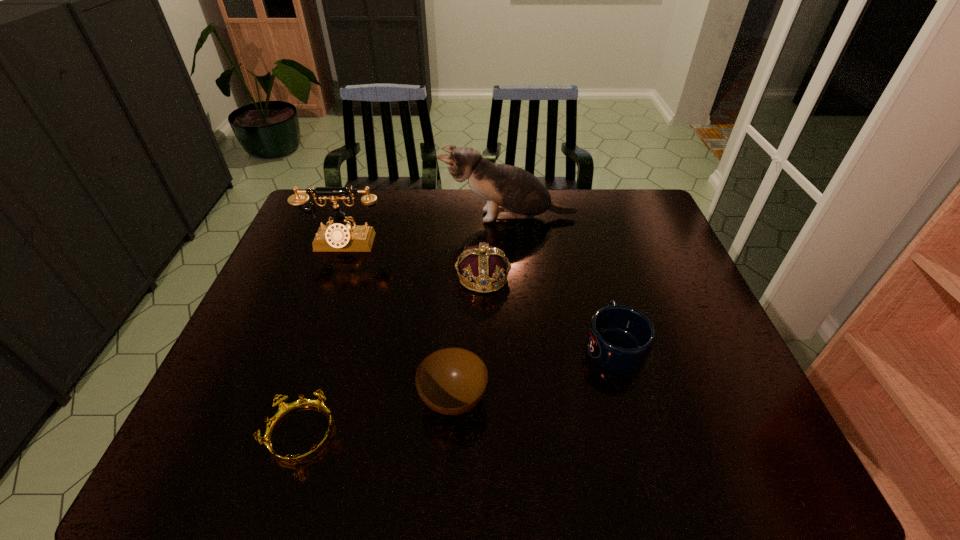
Locate an element on the screen. Image resolution: width=960 pixels, height=540 pixels. cat is located at coordinates (511, 192).

Locate an element on the screen. The height and width of the screenshot is (540, 960). the farthest object is located at coordinates (511, 192).

Locate an element on the screen. The image size is (960, 540). telephone is located at coordinates [x=340, y=236].

Locate an element on the screen. The image size is (960, 540). the second farthest object is located at coordinates (340, 236).

The height and width of the screenshot is (540, 960). In order to click on the taller crown in this screenshot , I will do click(488, 267).

Where is `the right crown`? This screenshot has width=960, height=540. the right crown is located at coordinates (488, 267).

This screenshot has height=540, width=960. Identify the location of mug. (620, 338).

Locate an element on the screen. The height and width of the screenshot is (540, 960). bowl is located at coordinates (451, 381).

Where is `the nearer crown`? the nearer crown is located at coordinates (285, 409).

At what (x,y) coordinates should I click in order to perform the action: click on the shorter crown. Please return your answer as a coordinate pair (x, y). Looking at the image, I should click on (285, 409).